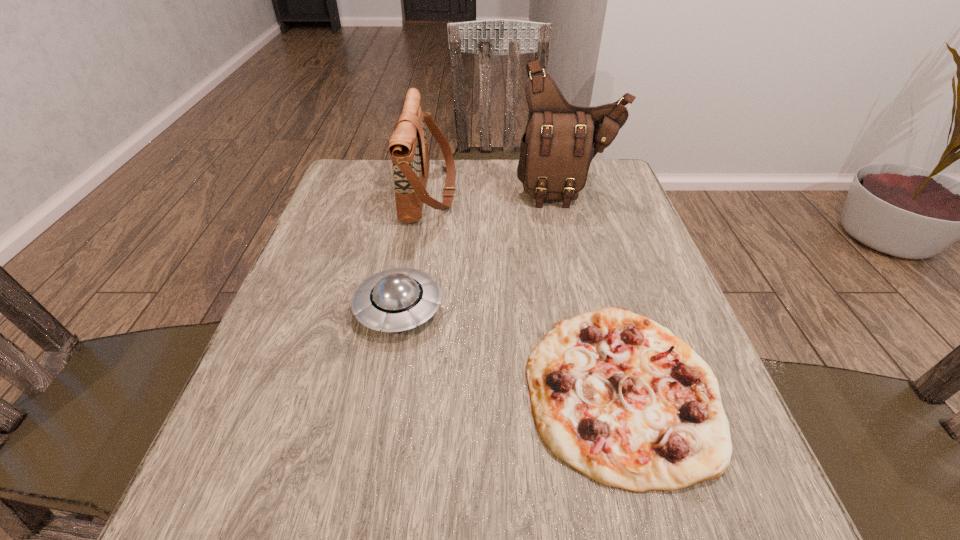
This screenshot has height=540, width=960. Identify the location of object that is at the near edge. (618, 397).

Locate an element on the screen. The image size is (960, 540). object that is at the left edge is located at coordinates (394, 300).

Where is `shoulder bag present at the right edge`? Image resolution: width=960 pixels, height=540 pixels. shoulder bag present at the right edge is located at coordinates (560, 140).

Find the location of a particular element. This screenshot has height=540, width=960. pizza at the right edge is located at coordinates (618, 397).

The width and height of the screenshot is (960, 540). In order to click on object that is at the far right corner in this screenshot , I will do `click(560, 140)`.

Locate an element on the screen. Image resolution: width=960 pixels, height=540 pixels. object located at the near right corner is located at coordinates [618, 397].

You are a GUI agent. You are given a task and a screenshot of the screen. Output one action in this format:
    pyautogui.click(x=<x>, y=<y>)
    Task: Click on the free space at the far edge of the desktop
    The width and height of the screenshot is (960, 540).
    Given the screenshot: What is the action you would take?
    pyautogui.click(x=483, y=172)

Locate an element on the screen. Image resolution: width=960 pixels, height=540 pixels. blank area at the near edge is located at coordinates (347, 481).

Identify the location of vacant area at the left edge. (351, 325).

In the image, there is a desktop. Where is `free space at the right edge`? free space at the right edge is located at coordinates (601, 239).